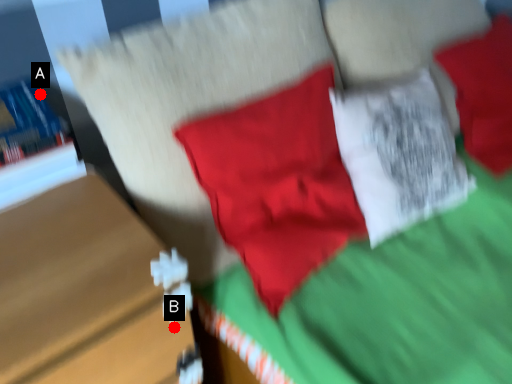
Question: Two points are circled on the image, labeled by A and B beside each circle. Which point is further to the camera?

Choices:
 (A) A is further
 (B) B is further

Answer: (A)